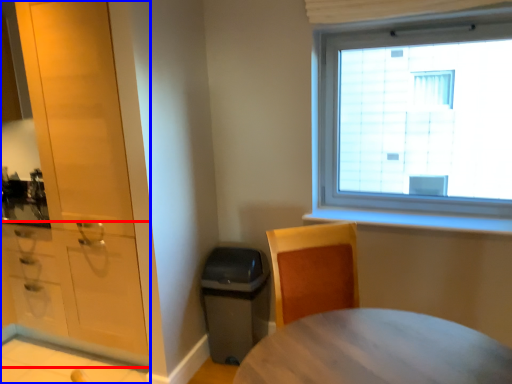
Question: Which object is closer to the camera taking this photo, cabinetry (highlighted by a red box) or cabinetry (highlighted by a blue box)?

Choices:
 (A) cabinetry
 (B) cabinetry

Answer: (B)